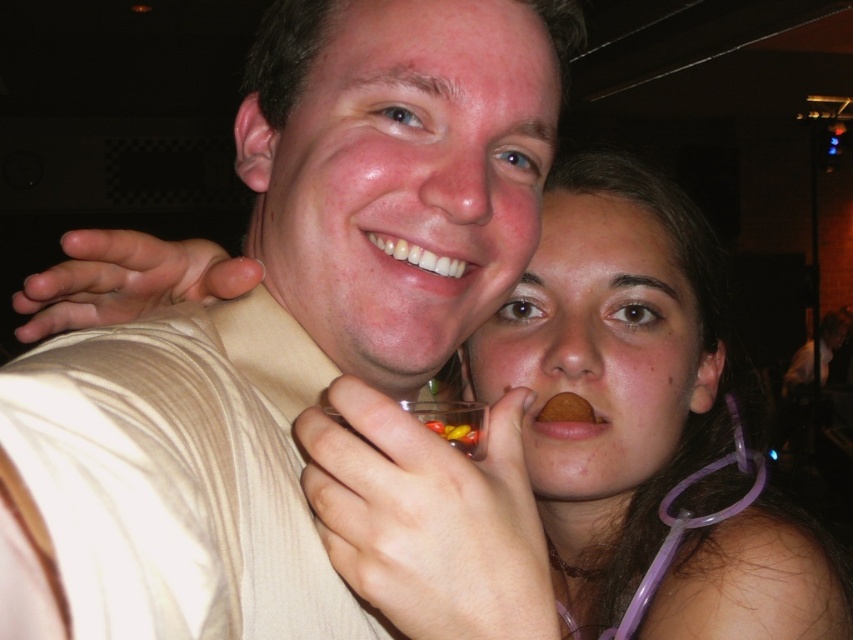
Does translucent plastic cup at center appear on the right side of brown matte cookie at mouth?

No, translucent plastic cup at center is not to the right of brown matte cookie at mouth.

Is the position of translucent plastic cup at center less distant than that of brown matte cookie at mouth?

Yes, it is.

This screenshot has width=853, height=640. Identify the location of translucent plastic cup at center. coord(453,422).

I want to click on translucent plastic cup at center, so click(x=453, y=422).

Which of these two, matte beige shirt at center or brown matte cookie at mouth, stands taller?

With more height is matte beige shirt at center.

What do you see at coordinates (282, 326) in the screenshot? I see `matte beige shirt at center` at bounding box center [282, 326].

Between point (289, 259) and point (573, 406), which one is positioned behind?

The point (573, 406) is behind.

I want to click on matte beige shirt at center, so [282, 326].

Is point (561, 394) farther from camera compared to point (466, 451)?

That is True.

Between brown matte cookie at mouth and translucent plastic candy at mouth, which one appears on the right side from the viewer's perspective?

Positioned to the right is brown matte cookie at mouth.

Which is behind, point (572, 401) or point (463, 449)?

The point (572, 401) is more distant.

At what (x,y) coordinates should I click in order to perform the action: click on brown matte cookie at mouth. Please return your answer as a coordinate pair (x, y). This screenshot has width=853, height=640. Looking at the image, I should click on (566, 410).